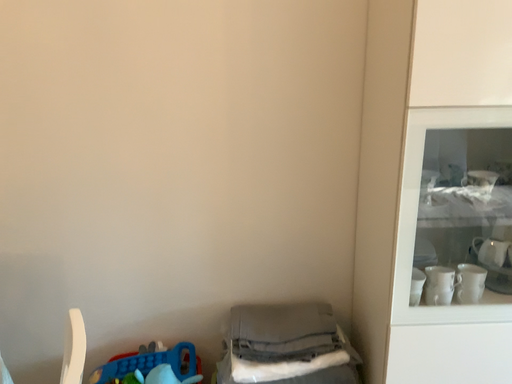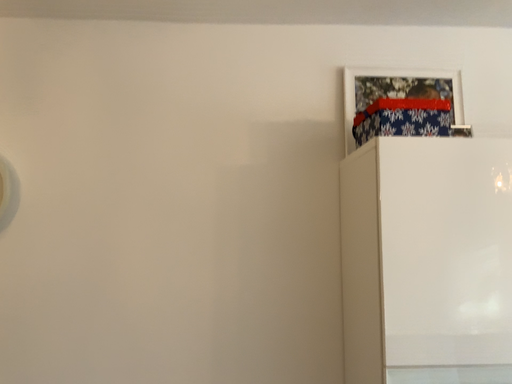
Question: How did the camera likely rotate when shooting the video?

Choices:
 (A) rotated upward
 (B) rotated downward

Answer: (A)